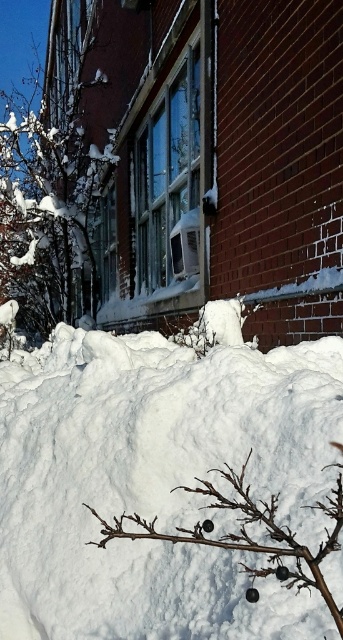
Question: Which object is the closest to the dark brown twig at lower center?

Choices:
 (A) white fluffy snow at lower center
 (B) snow-covered tree at left

Answer: (A)

Question: Can you confirm if white fluffy snow at lower center is positioned above dark brown twig at lower center?

Choices:
 (A) no
 (B) yes

Answer: (B)

Question: Which point is farther from the camera taking this photo?

Choices:
 (A) click(x=340, y=616)
 (B) click(x=52, y=307)
 (C) click(x=225, y=401)

Answer: (B)

Question: Is snow-covered tree at left to the right of dark brown twig at lower center from the viewer's perspective?

Choices:
 (A) yes
 (B) no

Answer: (B)

Question: Does snow-covered tree at left have a lesser width compared to dark brown twig at lower center?

Choices:
 (A) no
 (B) yes

Answer: (A)

Question: Among these points, which one is farthest from the camera?

Choices:
 (A) (195, 604)
 (B) (67, 298)

Answer: (B)